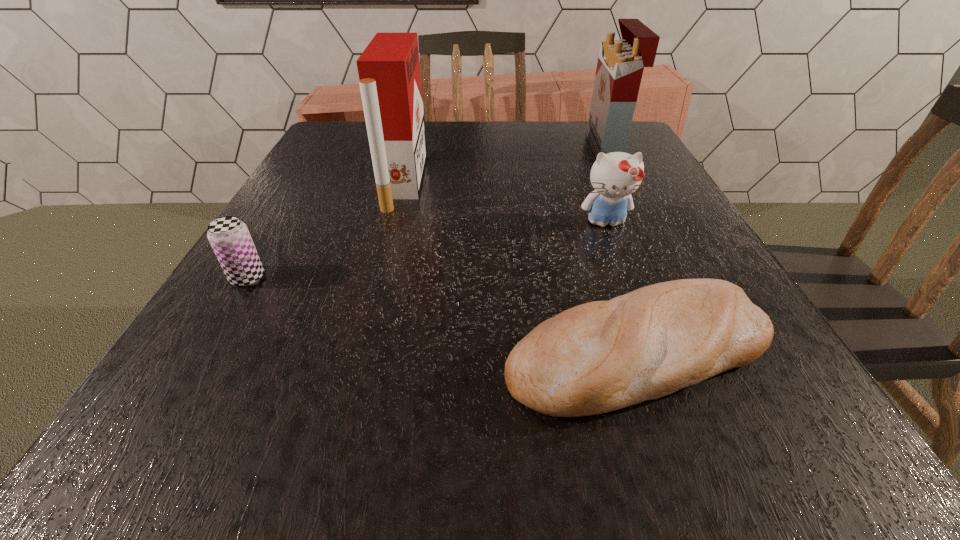
Find the location of `free spot located 0.330m on the front-facing side of the left cigarette case`. free spot located 0.330m on the front-facing side of the left cigarette case is located at coordinates (572, 181).

What are the coordinates of `vacant space located on the front-facing side of the third shortest object` in the screenshot? It's located at (x=660, y=365).

In order to click on vacant space located on the right of the leftmost object in this screenshot , I will do `click(404, 278)`.

At what (x,y) coordinates should I click in order to perform the action: click on vacant region located on the left of the bread. Please return your answer as a coordinate pair (x, y). Looking at the image, I should click on [329, 352].

Identify the location of object present at the near edge. (601, 356).

Locate an element on the screen. Image resolution: width=960 pixels, height=540 pixels. object positioned at the left edge is located at coordinates (229, 237).

At what (x,y) coordinates should I click in order to perform the action: click on cigarette case at the right edge. Please return your answer as a coordinate pair (x, y). This screenshot has width=960, height=540. Looking at the image, I should click on (620, 65).

Locate an element on the screen. Image resolution: width=960 pixels, height=540 pixels. kitten that is positioned at the right edge is located at coordinates (615, 176).

You are a GUI agent. You are given a task and a screenshot of the screen. Output one action in this format:
    pyautogui.click(x=<x>, y=<y>)
    Task: Click on the bread positioned at the right edge
    The height and width of the screenshot is (540, 960).
    Given the screenshot: What is the action you would take?
    pyautogui.click(x=601, y=356)

Image resolution: width=960 pixels, height=540 pixels. Find the location of `object present at the far right corner`. object present at the far right corner is located at coordinates (620, 65).